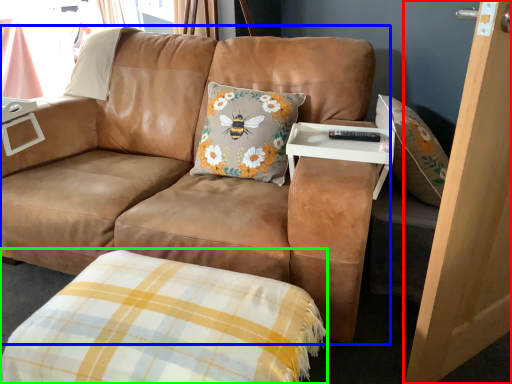
Question: Based on their relative distances, which object is nearer to screen door (highlighted by a red box)? Choose from studio couch (highlighted by a blue box) and plaid (highlighted by a green box).

Choices:
 (A) studio couch
 (B) plaid

Answer: (B)